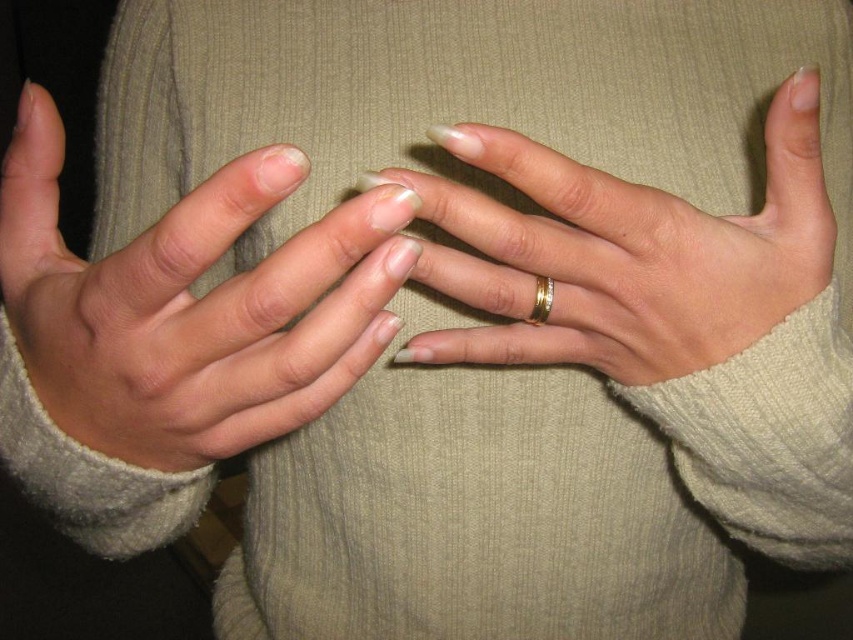
Based on the coordinates provided in the scene description, where exactly is the matte gold ring at center located?

The matte gold ring at center is located at point (x=193, y=307).

Based on the photo, you are holding a 12 inch ruler and want to measure the distance between the point at coordinates point (148, 449) and yourself. Can you do it without moving the ruler?

The distance between point point (148, 449) and the viewer is 15.28 inches. Since the ruler is only 12 inches long, it is not long enough to measure the distance between point point (148, 449) and yourself.